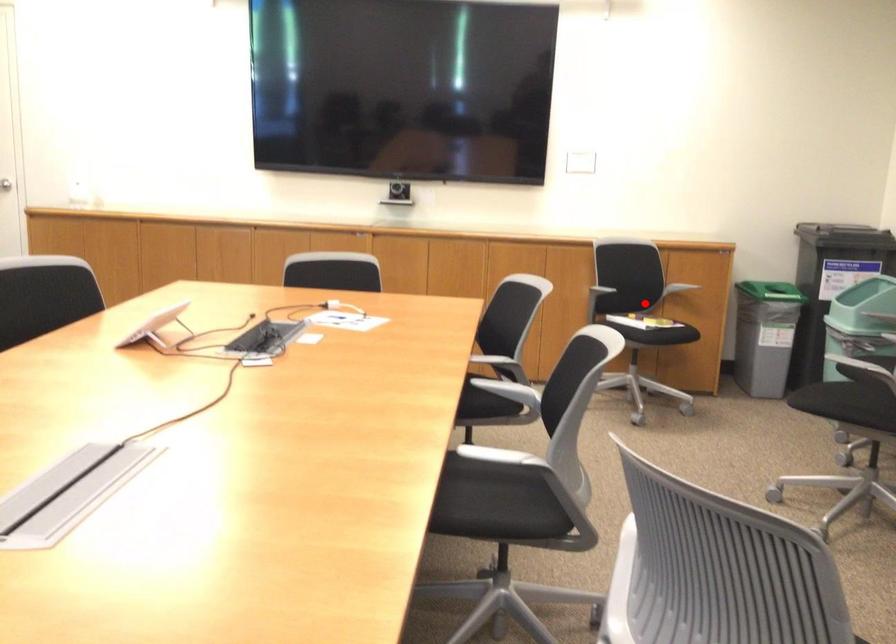
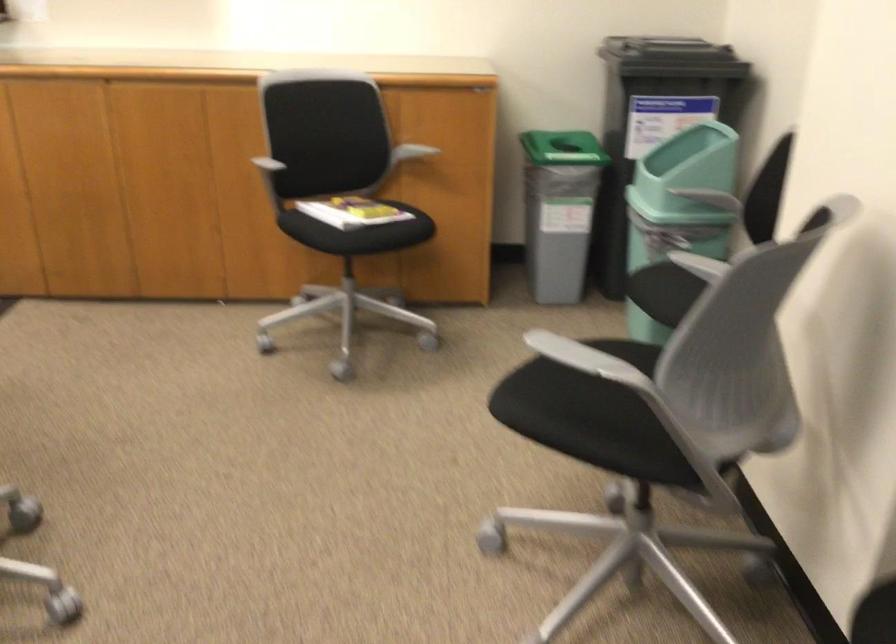
In the second image, find the point that corresponds to the highlighted location in the first image.

(355, 212)